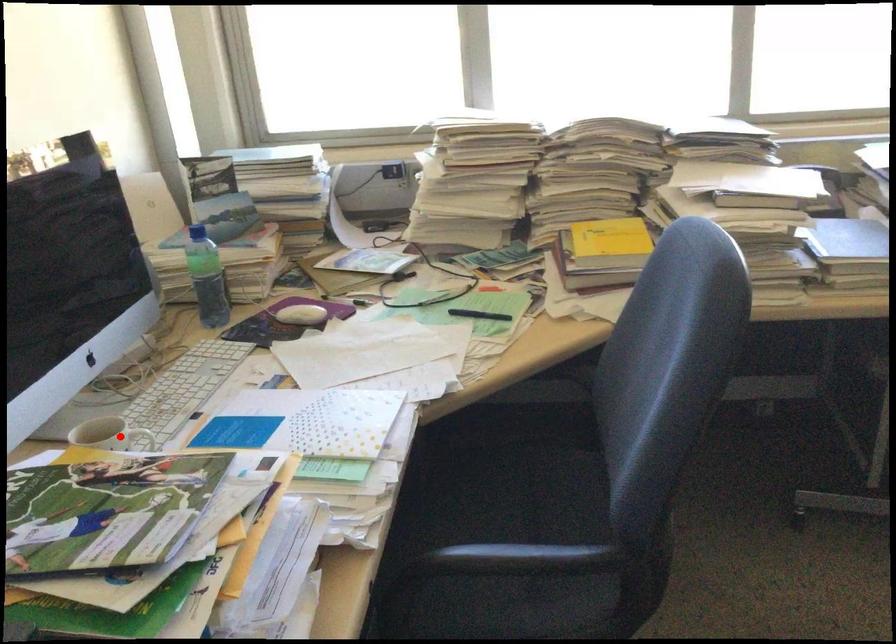
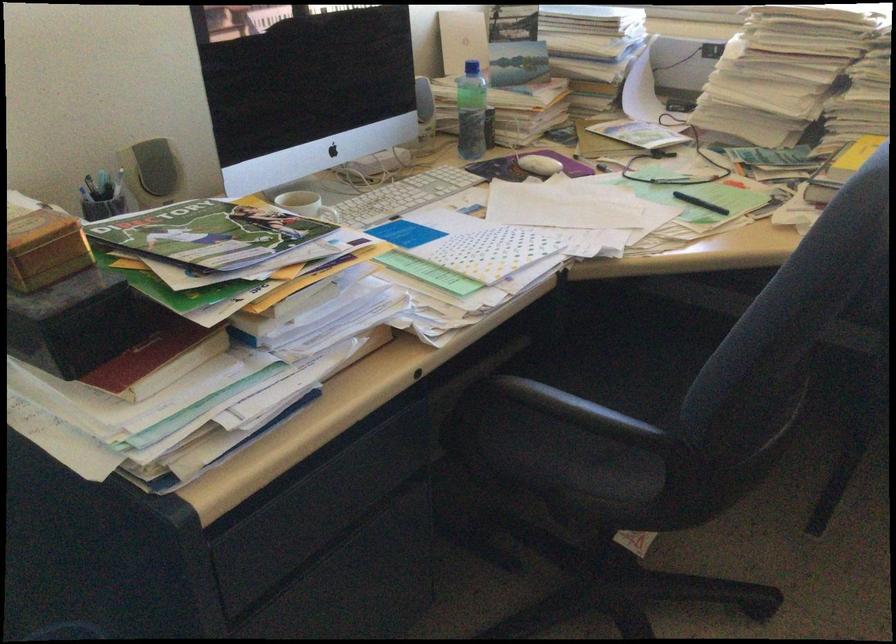
In the second image, find the point that corresponds to the highlighted location in the first image.

(334, 216)